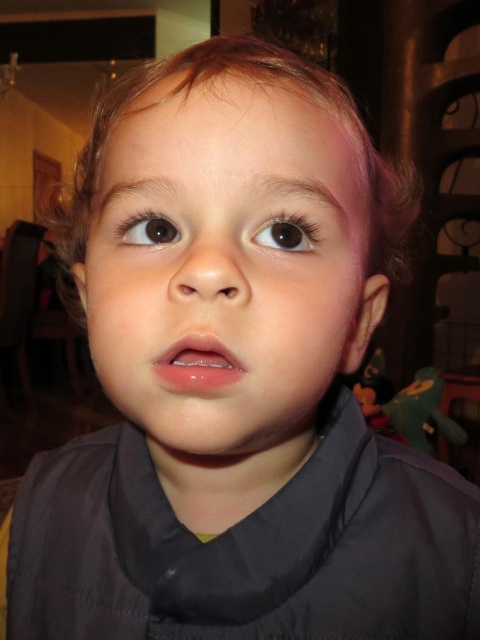
Can you confirm if blonde curly hair at center is positioned above brown glossy eye at upper left?

Yes.

Is blonde curly hair at center smaller than brown glossy eye at upper left?

Incorrect, blonde curly hair at center is not smaller in size than brown glossy eye at upper left.

Does point (66, 211) come closer to viewer compared to point (167, 240)?

No, it is behind (167, 240).

You are a GUI agent. You are given a task and a screenshot of the screen. Output one action in this format:
    pyautogui.click(x=<x>, y=<y>)
    Task: Click on the blonde curly hair at center
    This screenshot has width=480, height=640.
    Given the screenshot: What is the action you would take?
    pyautogui.click(x=254, y=88)

What do you see at coordinates (286, 234) in the screenshot? The width and height of the screenshot is (480, 640). I see `brown glossy eye at upper center` at bounding box center [286, 234].

Who is shorter, brown glossy eye at upper center or brown glossy eye at upper left?

With less height is brown glossy eye at upper left.

Who is more distant from viewer, (301, 227) or (139, 230)?

Point (139, 230)

Identify the location of brown glossy eye at upper center. coord(286,234).

Who is more forward, (296, 177) or (172, 74)?

Point (296, 177) is more forward.

Between smooth skin face at center and blonde curly hair at center, which one has less height?

Standing shorter between the two is smooth skin face at center.

Which is behind, point (107, 291) or point (175, 60)?

The point (175, 60) is behind.

You are a GUI agent. You are given a task and a screenshot of the screen. Output one action in this format:
    pyautogui.click(x=<x>, y=<y>)
    Task: Click on the smooth skin face at center
    
    Given the screenshot: What is the action you would take?
    [x=225, y=266]